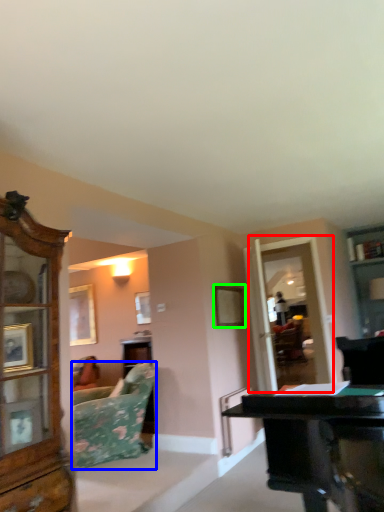
Question: Which object is positioned closest to glass door (highlighted by a red box)? Select from studio couch (highlighted by a blue box) and picture frame (highlighted by a green box).

Choices:
 (A) studio couch
 (B) picture frame

Answer: (B)